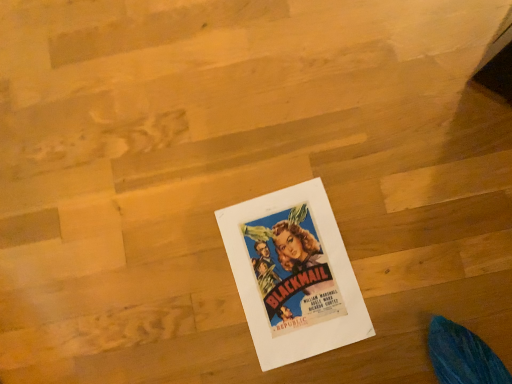
At what (x,y) coordinates should I click in order to perform the action: click on vacant area on top of matte paper poster at center (from a real-world perspective). Please return your answer as a coordinate pair (x, y). Looking at the image, I should click on (296, 272).